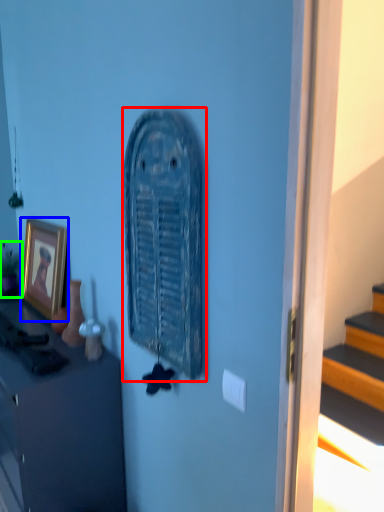
Question: Considering the real-world distances, which object is farthest from art (highlighted by a red box)? picture frame (highlighted by a blue box) or houseplant (highlighted by a green box)?

Choices:
 (A) picture frame
 (B) houseplant

Answer: (B)